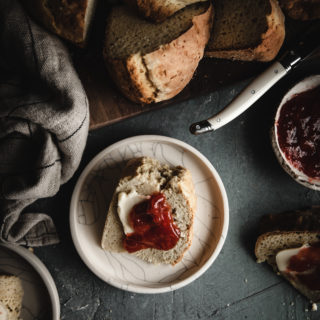
Where is `handle`? The width and height of the screenshot is (320, 320). handle is located at coordinates (220, 119), (264, 81).